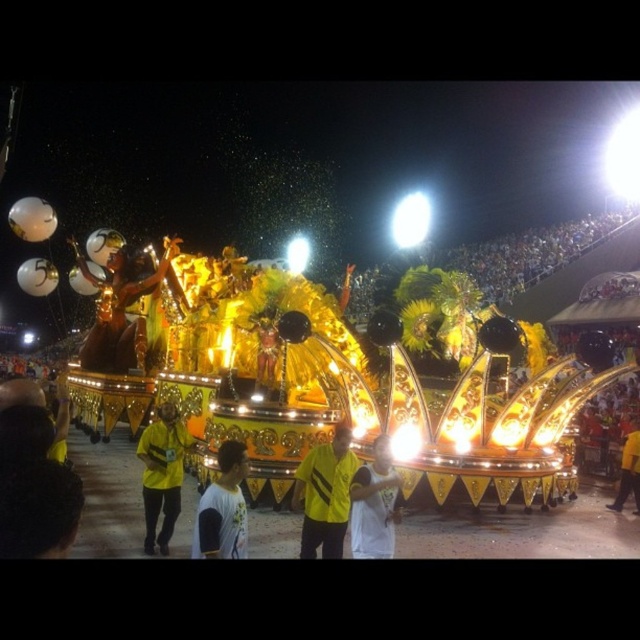
You are standing at the center of the image and see the point labeled as point [324,493]. What object is located at that point?

The point [324,493] corresponds to the yellow fabric shirt at center.

You are at the carnival and notice both the gold metallic statue at center and the white matte shirt at center. Which object is positioned higher from the ground?

The gold metallic statue at center is located above the white matte shirt at center, so it is positioned higher from the ground.

You are a photographer trying to capture a clear photo of the gold metallic statue at center without the yellow fabric person at lower left appearing in the foreground. Based on their positions, is this possible?

The yellow fabric person at lower left is positioned under the gold metallic statue at center, so adjusting the camera angle upwards might allow you to capture the statue without the person blocking it.